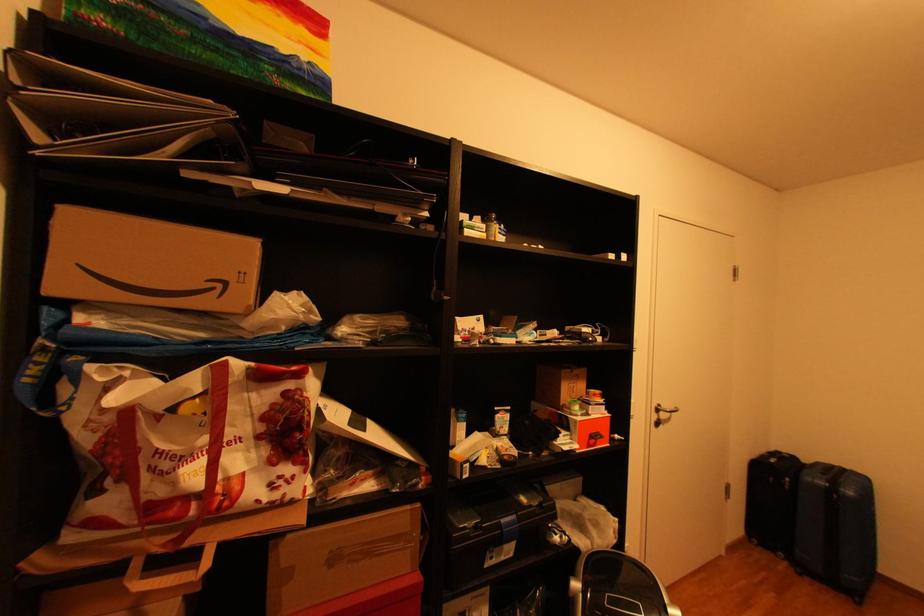
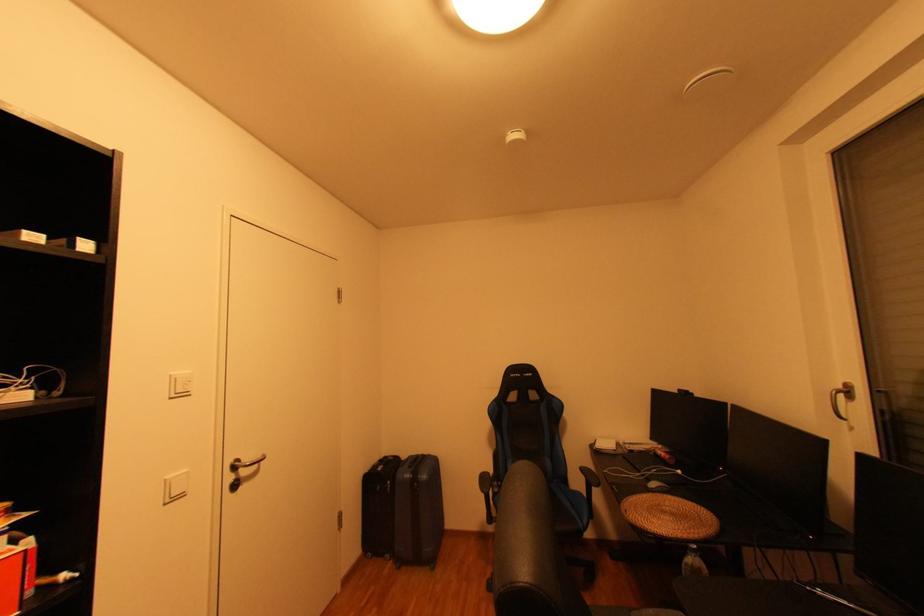
In the second image, find the point that corresponds to [764,541] in the first image.

(380, 554)